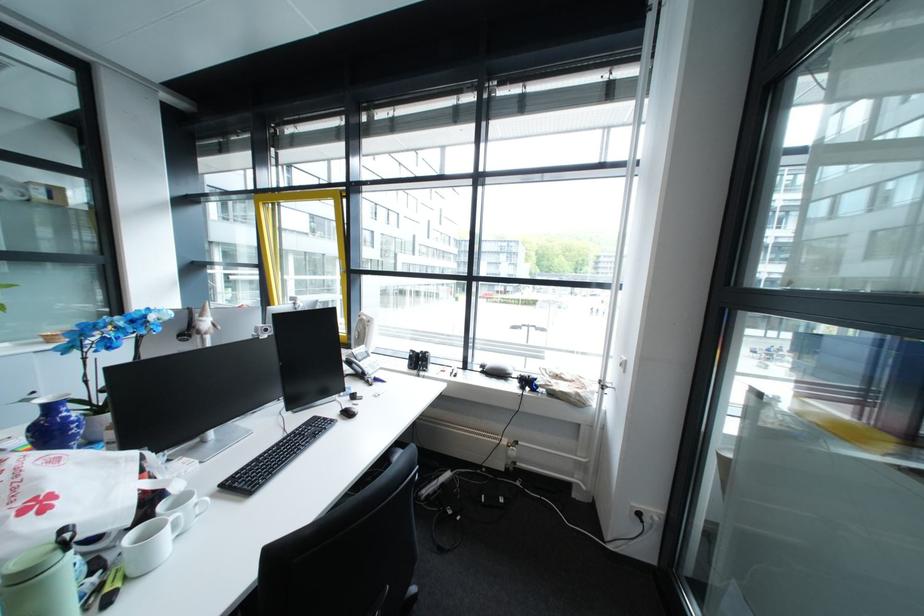
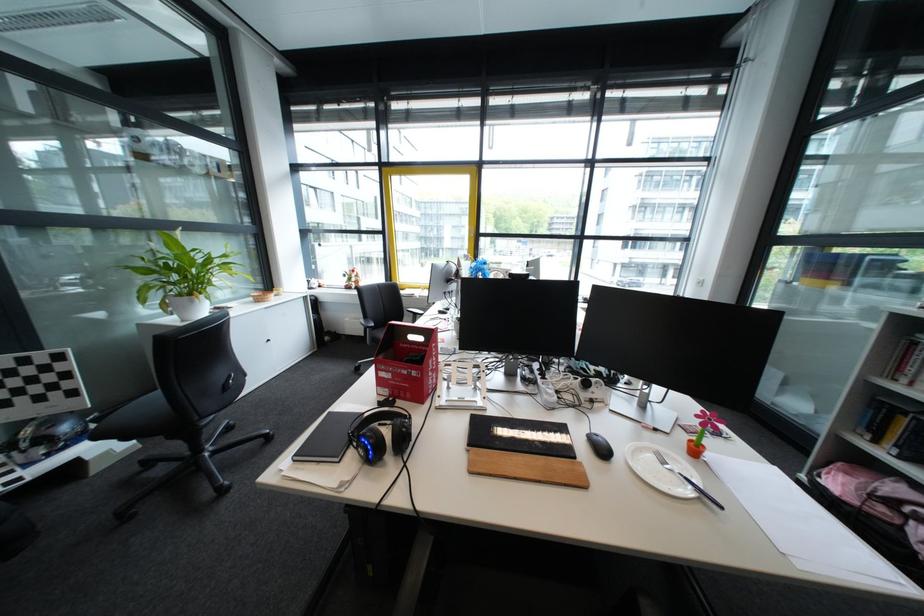
Find the pixel in the second image that matches (509,286) in the first image.

(472, 251)